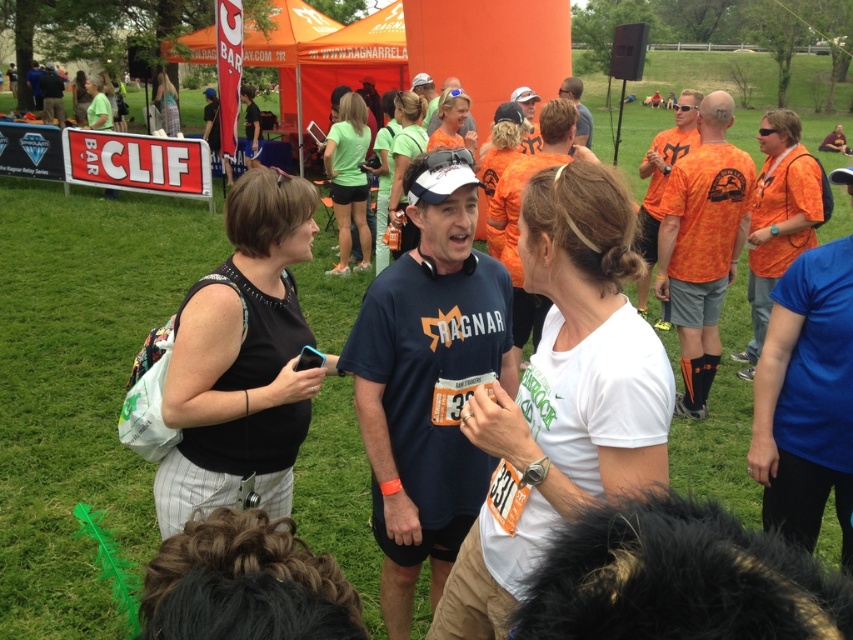
Is green fabric shorts at center bigger than green fabric shirt at center?

No, green fabric shorts at center is not bigger than green fabric shirt at center.

Between green fabric shorts at center and green fabric shirt at center, which one appears on the left side from the viewer's perspective?

green fabric shorts at center is more to the left.

I want to click on green fabric shorts at center, so click(347, 177).

Identify the location of green fabric shorts at center. This screenshot has height=640, width=853. (347, 177).

Who is more distant from viewer, (601, 188) or (329, 148)?

The point (329, 148) is behind.

In order to click on white matte t-shirt at center in this screenshot , I will do `click(561, 397)`.

Which of these two, black fabric bag at left or matte orange shirt at center, stands shorter?

matte orange shirt at center

From the picture: Can you confirm if black fabric bag at left is smaller than matte orange shirt at center?

Yes, black fabric bag at left is smaller than matte orange shirt at center.

In order to click on black fabric bag at left in this screenshot , I will do `click(242, 360)`.

The height and width of the screenshot is (640, 853). I want to click on black fabric bag at left, so click(242, 360).